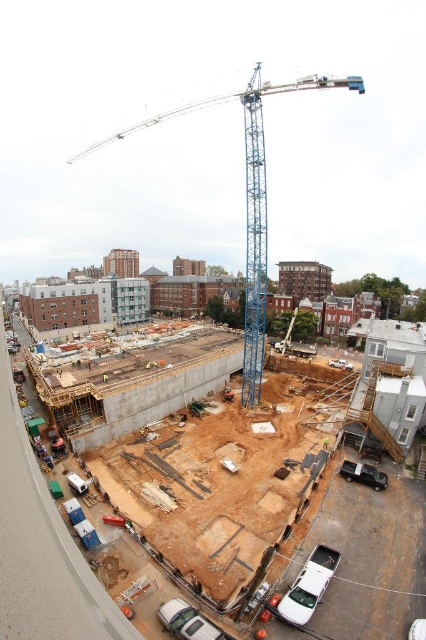
How distant is silver metallic car at lower center from shiny black truck at lower right?

silver metallic car at lower center and shiny black truck at lower right are 108.13 feet apart from each other.

Is point (183, 605) positioned behind point (345, 472)?

No, it is not.

Identify the location of silver metallic car at lower center. This screenshot has width=426, height=640. 189,621.

Which is in front, point (247, 163) or point (199, 632)?

Point (199, 632) is more forward.

Can you confirm if blue metallic crane at center is positioned to the right of silver metallic car at lower center?

Correct, you'll find blue metallic crane at center to the right of silver metallic car at lower center.

The image size is (426, 640). Find the location of `blue metallic crane at center`. blue metallic crane at center is located at coordinates (247, 198).

Can you confirm if brown concrete foundation at center is positioned above yellow reflective safety vest at center?

No, brown concrete foundation at center is not above yellow reflective safety vest at center.

Is brown concrete foundation at center positioned behind yellow reflective safety vest at center?

That is False.

Where is `brown concrete foundation at center`? The width and height of the screenshot is (426, 640). brown concrete foundation at center is located at coordinates (368, 560).